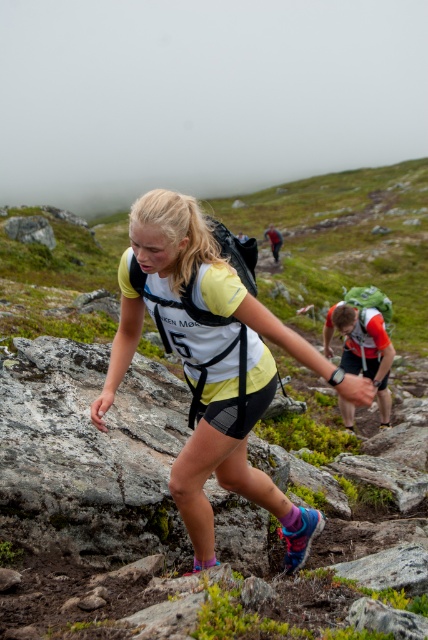
You are a race organizer analyzing the trail map. You notice two points marked on the trail at coordinates point (220, 449) and point (369, 342). Based on the scene description, which point is closer to the starting line?

Point (220, 449) is in front of point (369, 342), so it is closer to the starting line.

You are a photographer positioned at the starting line of the mountain race. You need to capture a photo where both the yellow fabric shirt at center and orange mesh backpack at center are clearly visible. Given their sizes, which object should you focus on to ensure both are in frame without zooming in or out?

The yellow fabric shirt at center has a smaller width compared to the orange mesh backpack at center. To ensure both are in frame without zooming, focus on the orange mesh backpack at center as it is larger and will remain visible while the smaller yellow fabric shirt at center fits within the same frame.

You are a photographer positioned at the starting line of the mountain trail race. You want to capture a photo where both the yellow fabric shirt at center and the orange mesh backpack at center are clearly visible. Based on their sizes, which object should you focus on first to ensure both are in frame?

The yellow fabric shirt at center has a lesser height compared to the orange mesh backpack at center, so you should focus on the orange mesh backpack at center first to ensure both are in frame.